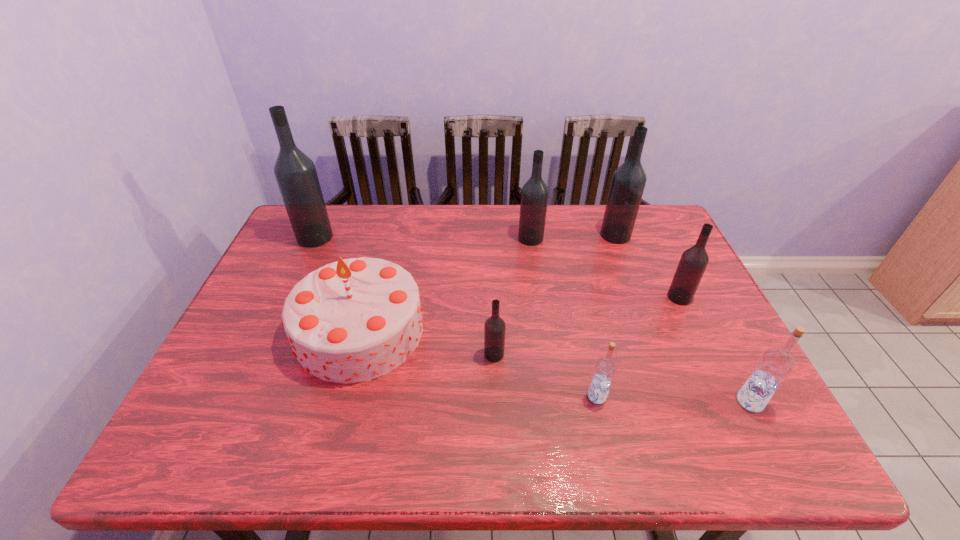
Find the location of `vodka object that ranks as the sixth closest to the leftmost object`. vodka object that ranks as the sixth closest to the leftmost object is located at coordinates (775, 365).

Image resolution: width=960 pixels, height=540 pixels. I want to click on vodka that stands as the fourth closest to the rightmost black vodka, so click(534, 195).

Where is `black vodka that is the second nearest to the leftmost object`? black vodka that is the second nearest to the leftmost object is located at coordinates (494, 329).

Select which black vodka is the second closest to the leftmost black vodka. Please provide its 2D coordinates. Your answer should be formatted as a tuple, i.e. [(x, y)], where the tuple contains the x and y coordinates of a point satisfying the conditions above.

[(494, 329)]

You are a GUI agent. You are given a task and a screenshot of the screen. Output one action in this format:
    pyautogui.click(x=<x>, y=<y>)
    Task: Click on the vacant space that satisfies the following two spatial constraints: 1. on the front side of the leftmost vodka; 2. on the right side of the fourth vodka from left to right
    This screenshot has height=540, width=960.
    Given the screenshot: What is the action you would take?
    pyautogui.click(x=242, y=396)

In order to click on vacant space that satisfies the following two spatial constraints: 1. on the front side of the bigger blue vodka; 2. on the left side of the leftmost object in this screenshot , I will do `click(239, 401)`.

Identify the location of vacant position in the image that satisfies the following two spatial constraints: 1. on the front side of the leftmost black vodka; 2. on the left side of the fourth object from left to right. The width and height of the screenshot is (960, 540). (314, 239).

Locate an element on the screen. free space that satisfies the following two spatial constraints: 1. on the front side of the bigger blue vodka; 2. on the right side of the fifth vodka from right to left is located at coordinates (554, 401).

Locate an element on the screen. Image resolution: width=960 pixels, height=540 pixels. vacant space that satisfies the following two spatial constraints: 1. on the back side of the third biggest black vodka; 2. on the right side of the fourth black vodka from left to right is located at coordinates (530, 235).